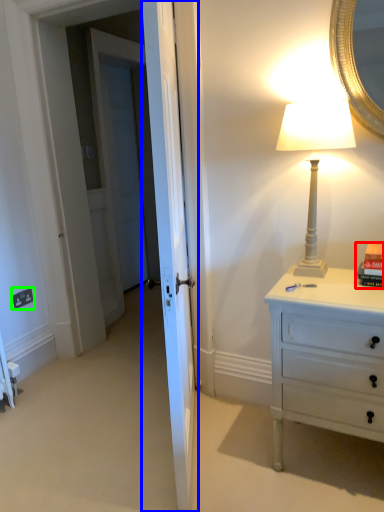
Question: Estimate the real-world distances between objects in this image. Which object is closer to book (highlighted by a red box), door (highlighted by a blue box) or electric outlet (highlighted by a green box)?

Choices:
 (A) door
 (B) electric outlet

Answer: (A)